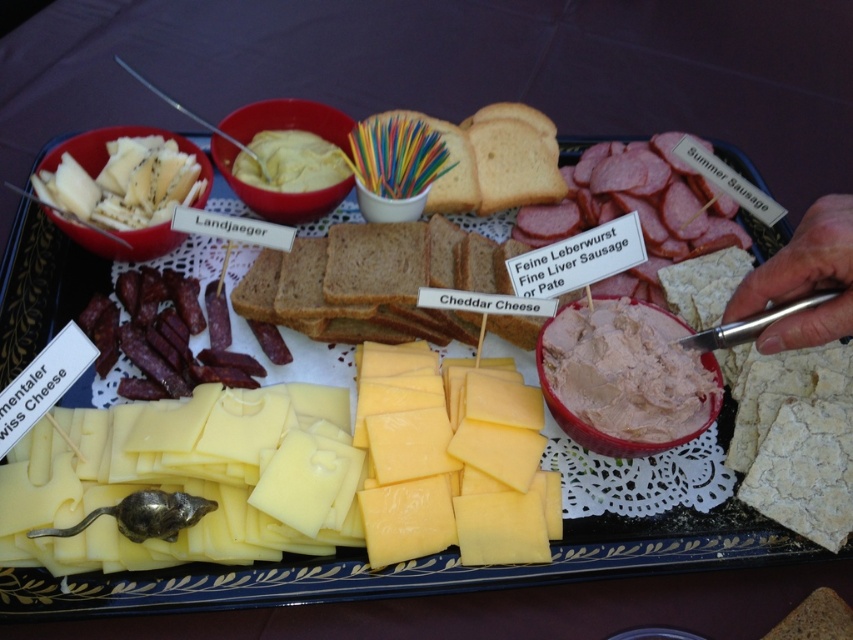
Between brown matte bread at center and pink creamy spread at center, which one is positioned higher?

Positioned higher is brown matte bread at center.

Is brown matte bread at center to the left of pink creamy spread at center from the viewer's perspective?

Yes, brown matte bread at center is to the left of pink creamy spread at center.

You are a GUI agent. You are given a task and a screenshot of the screen. Output one action in this format:
    pyautogui.click(x=<x>, y=<y>)
    Task: Click on the brown matte bread at center
    The height and width of the screenshot is (640, 853).
    Given the screenshot: What is the action you would take?
    pyautogui.click(x=372, y=282)

Between point (323, 436) and point (360, 310), which one is positioned behind?

Point (360, 310)

This screenshot has width=853, height=640. What do you see at coordinates (314, 467) in the screenshot? I see `yellow hard cheese at center` at bounding box center [314, 467].

I want to click on yellow hard cheese at center, so click(x=314, y=467).

Does yellow hard cheese at center have a lesser height compared to white creamy spread at center?

Incorrect, yellow hard cheese at center's height does not fall short of white creamy spread at center's.

Does yellow hard cheese at center have a smaller size compared to white creamy spread at center?

Incorrect, yellow hard cheese at center is not smaller in size than white creamy spread at center.

Is point (430, 374) closer to camera compared to point (254, 180)?

That is True.

Find the location of a particular element. yellow hard cheese at center is located at coordinates (314, 467).